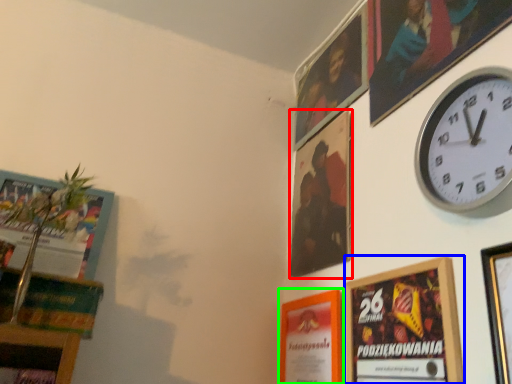
Question: Which object is positioned farthest from picture frame (highlighted by a red box)? Select from picture frame (highlighted by a blue box) and picture frame (highlighted by a green box).

Choices:
 (A) picture frame
 (B) picture frame

Answer: (A)